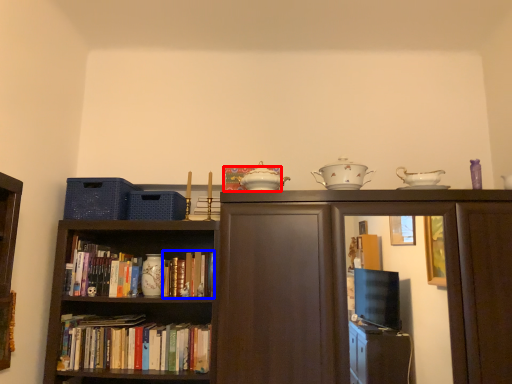
Question: Among these objects, which one is farthest to the camera, book (highlighted by a red box) or book (highlighted by a blue box)?

Choices:
 (A) book
 (B) book

Answer: (B)